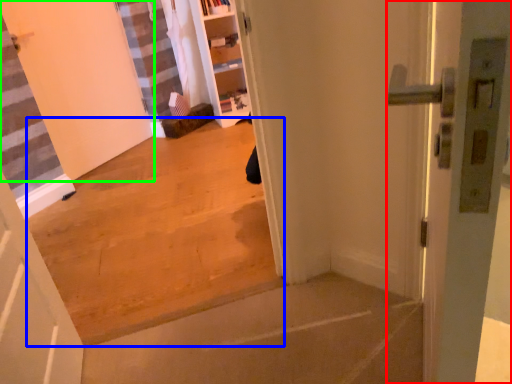
Question: Estimate the real-world distances between objects in this image. Which object is farther from door (highlighted by a red box), concrete (highlighted by a blue box) or door (highlighted by a green box)?

Choices:
 (A) concrete
 (B) door

Answer: (B)